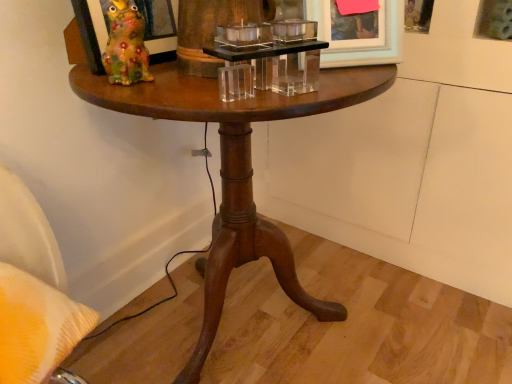
Question: Could you tell me if wooden picture frame at upper right, the first picture frame when ordered from right to left, is turned towards matte ceramic frog at upper left, which is the 1th picture frame in left-to-right order?

Choices:
 (A) yes
 (B) no

Answer: (B)

Question: From a real-world perspective, is wooden picture frame at upper right, positioned as the third picture frame in left-to-right order, on top of matte ceramic frog at upper left, which is the 1th picture frame in left-to-right order?

Choices:
 (A) yes
 (B) no

Answer: (B)

Question: Can matte ceramic frog at upper left, the third picture frame when ordered from right to left, be found inside wooden picture frame at upper right, the first picture frame when ordered from right to left?

Choices:
 (A) no
 (B) yes

Answer: (A)

Question: Is wooden picture frame at upper right, the first picture frame when ordered from right to left, positioned beyond the bounds of matte ceramic frog at upper left, which is the 1th picture frame in left-to-right order?

Choices:
 (A) yes
 (B) no

Answer: (A)

Question: Can you confirm if wooden picture frame at upper right, the first picture frame when ordered from right to left, is bigger than matte ceramic frog at upper left, which is the 1th picture frame in left-to-right order?

Choices:
 (A) no
 (B) yes

Answer: (B)

Question: From a real-world perspective, is wooden picture frame at upper right, positioned as the third picture frame in left-to-right order, above or below clear acrylic candle holder at center?

Choices:
 (A) above
 (B) below

Answer: (A)

Question: From the image's perspective, is wooden picture frame at upper right, the first picture frame when ordered from right to left, above or below clear acrylic candle holder at center?

Choices:
 (A) below
 (B) above

Answer: (B)

Question: Is wooden picture frame at upper right, the first picture frame when ordered from right to left, taller or shorter than clear acrylic candle holder at center?

Choices:
 (A) tall
 (B) short

Answer: (A)

Question: Is wooden picture frame at upper right, the first picture frame when ordered from right to left, in front of or behind clear acrylic candle holder at center in the image?

Choices:
 (A) behind
 (B) front

Answer: (A)

Question: Based on their positions, is matte white picture frame at upper right, which is counted as the second picture frame, starting from the left, located to the left or right of clear acrylic candle holder at center?

Choices:
 (A) left
 (B) right

Answer: (B)

Question: From the image's perspective, is matte white picture frame at upper right, which is counted as the second picture frame, starting from the left, positioned above or below clear acrylic candle holder at center?

Choices:
 (A) below
 (B) above

Answer: (B)

Question: Considering the positions of matte white picture frame at upper right, the 2th picture frame in the right-to-left sequence, and clear acrylic candle holder at center in the image, is matte white picture frame at upper right, the 2th picture frame in the right-to-left sequence, taller or shorter than clear acrylic candle holder at center?

Choices:
 (A) short
 (B) tall

Answer: (B)

Question: Is point (372, 21) positioned closer to the camera than point (228, 66)?

Choices:
 (A) farther
 (B) closer

Answer: (A)

Question: From their relative heights in the image, would you say wooden picture frame at upper right, positioned as the third picture frame in left-to-right order, is taller or shorter than matte white picture frame at upper right, the 2th picture frame in the right-to-left sequence?

Choices:
 (A) tall
 (B) short

Answer: (A)

Question: Relative to matte white picture frame at upper right, the 2th picture frame in the right-to-left sequence, is wooden picture frame at upper right, the first picture frame when ordered from right to left, in front or behind?

Choices:
 (A) front
 (B) behind

Answer: (B)